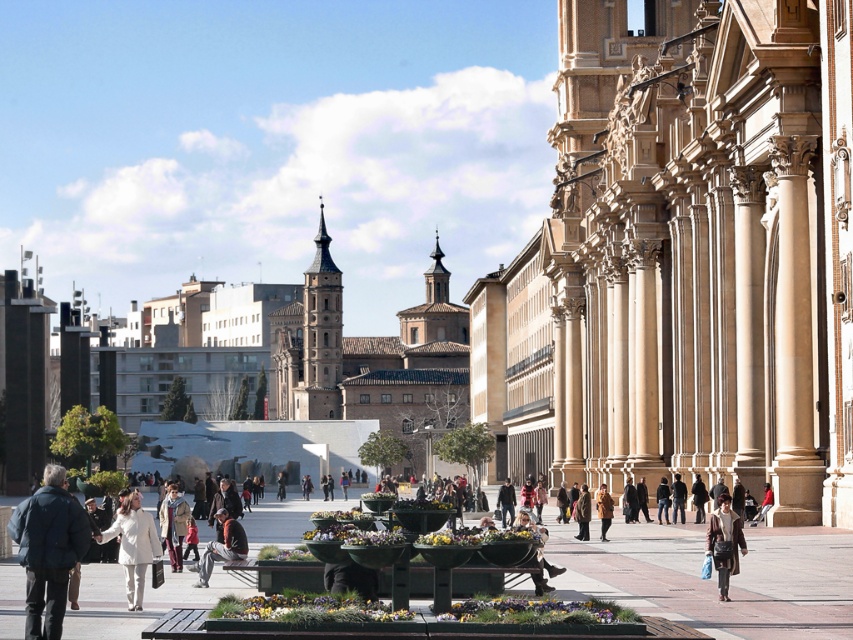
Question: Among these points, which one is farthest from the camera?

Choices:
 (A) (732, 512)
 (B) (601, 518)
 (C) (45, 563)

Answer: (B)

Question: Which of the following is the closest to the observer?

Choices:
 (A) white wool coat at center
 (B) brown leather jacket at center

Answer: (A)

Question: Is dark blue jacket at lower left above white wool coat at center?

Choices:
 (A) no
 (B) yes

Answer: (B)

Question: Is dark blue jacket at lower left closer to camera compared to denim jacket at center?

Choices:
 (A) yes
 (B) no

Answer: (A)

Question: Considering the real-world distances, which object is farthest from the brown leather jacket at center?

Choices:
 (A) brown textured coat at center
 (B) denim jacket at center
 (C) brown wool coat at center
 (D) dark brown leather jacket at center

Answer: (B)

Question: Does brown textured coat at center appear over denim jacket at center?

Choices:
 (A) yes
 (B) no

Answer: (B)